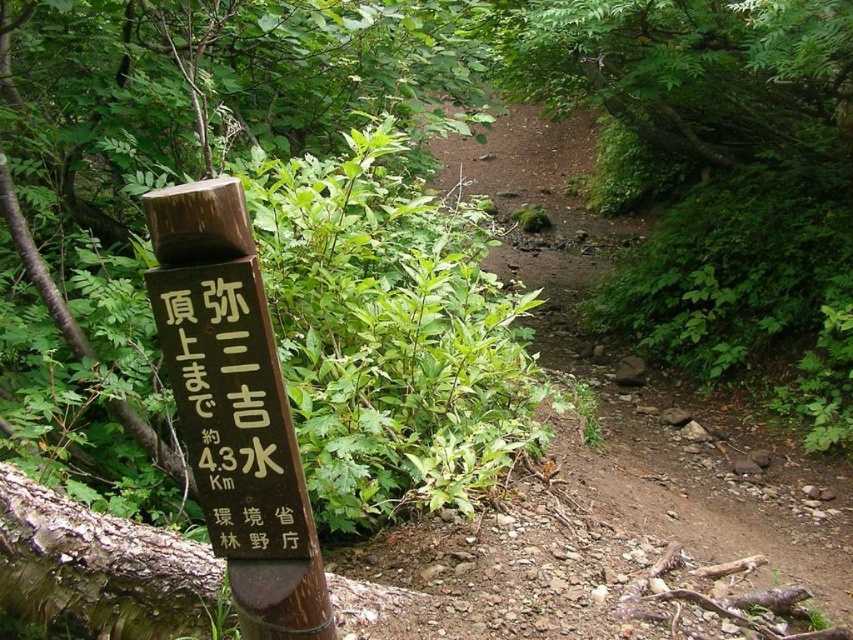
Question: Can you confirm if brown wooden signpost at left is wider than brown wooden signpost at center-left?

Choices:
 (A) no
 (B) yes

Answer: (B)

Question: Which object appears farthest from the camera in this image?

Choices:
 (A) brown wooden signpost at left
 (B) brown wooden signpost at center-left

Answer: (B)

Question: Which of the following is the farthest from the observer?

Choices:
 (A) (271, 454)
 (B) (450, 173)

Answer: (B)

Question: Is brown dirt trail at center to the right of brown wooden signpost at left from the viewer's perspective?

Choices:
 (A) yes
 (B) no

Answer: (A)

Question: Is brown dirt trail at center bigger than brown wooden signpost at center-left?

Choices:
 (A) yes
 (B) no

Answer: (A)

Question: Which is farther from the brown dirt trail at center?

Choices:
 (A) brown wooden signpost at center-left
 (B) brown wooden signpost at left

Answer: (A)